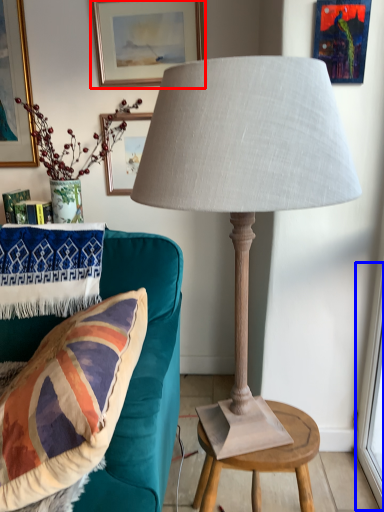
Question: Which point is closer to the camera, picture frame (highlighted by a red box) or window screen (highlighted by a blue box)?

Choices:
 (A) picture frame
 (B) window screen

Answer: (B)